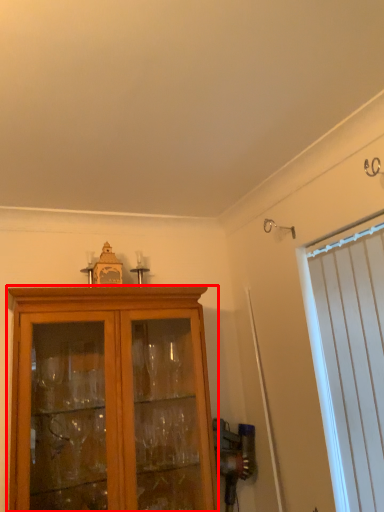
Question: From the image's perspective, where is cabinetry (annotated by the red box) located relative to curtain?

Choices:
 (A) above
 (B) below

Answer: (B)